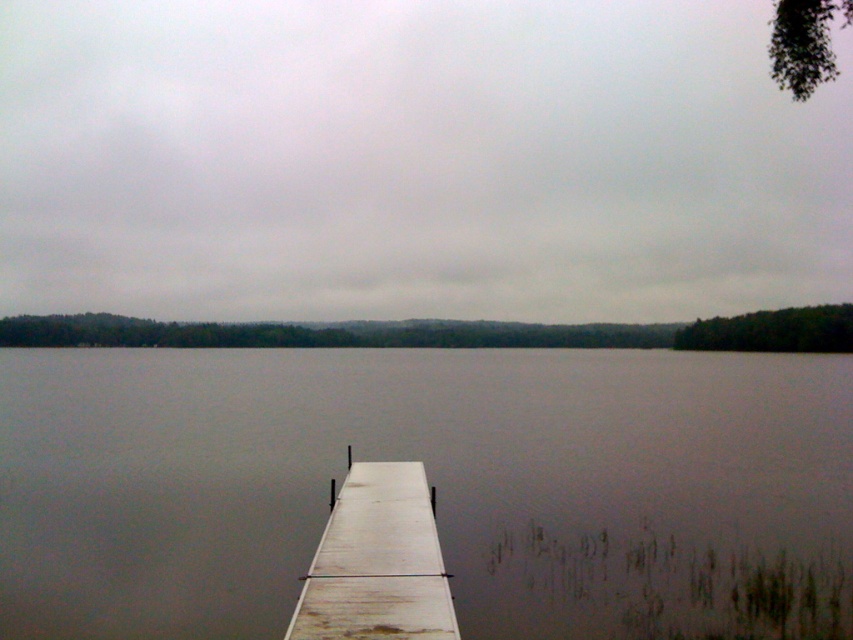
Which is above, smooth gray water at center or white wood dock at lower center?

smooth gray water at center

Between smooth gray water at center and white wood dock at lower center, which one is positioned lower?

white wood dock at lower center is below.

Which is behind, point (711, 490) or point (329, 556)?

The point (711, 490) is behind.

Where is `smooth gray water at center`? smooth gray water at center is located at coordinates (380, 458).